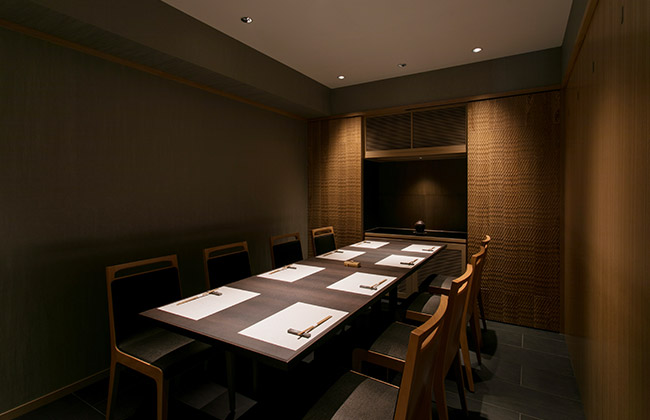
This screenshot has height=420, width=650. What are the coordinates of `small ornament in centre of shelf` in the screenshot? It's located at (418, 224).